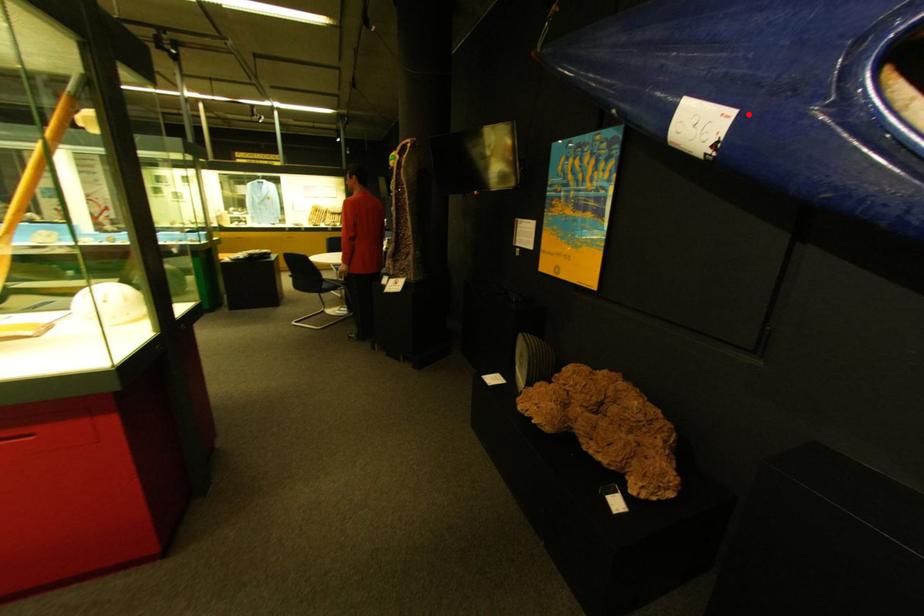
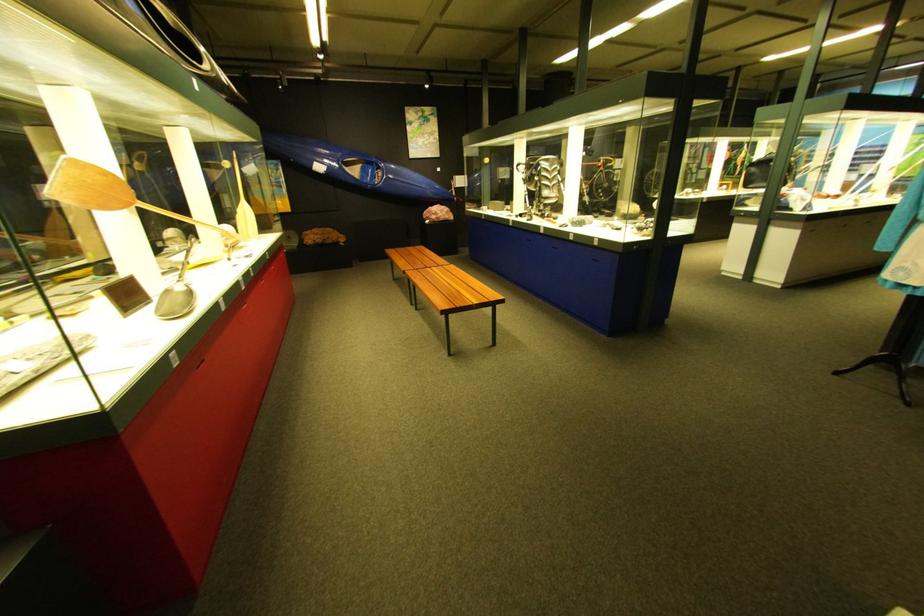
Where in the second image is the point corresponding to the highlighted location from the first image?

(342, 169)